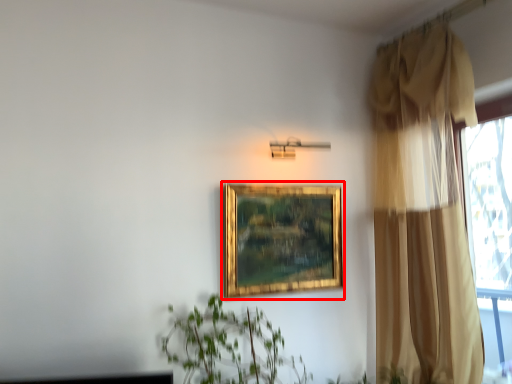
Question: From the image's perspective, what is the correct spatial positioning of picture frame (annotated by the red box) in reference to curtain?

Choices:
 (A) below
 (B) above

Answer: (A)